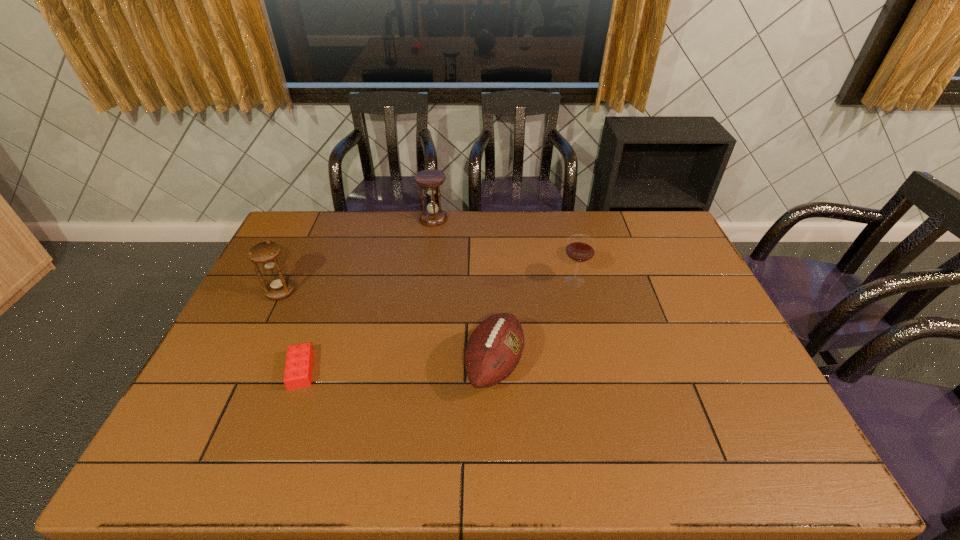
The width and height of the screenshot is (960, 540). I want to click on vacant space located 0.160m on the right of the wineglass, so click(x=637, y=281).

Locate an element on the screen. This screenshot has height=540, width=960. vacant space located on the back of the fourth object from left to right is located at coordinates (492, 289).

You are a GUI agent. You are given a task and a screenshot of the screen. Output one action in this format:
    pyautogui.click(x=<x>, y=<y>)
    Task: Click on the vacant region located 0.080m on the left of the Lego
    The height and width of the screenshot is (540, 960).
    Given the screenshot: What is the action you would take?
    pyautogui.click(x=255, y=370)

Image resolution: width=960 pixels, height=540 pixels. I want to click on object at the far edge, so click(x=433, y=216).

At what (x,y) coordinates should I click in order to perform the action: click on object at the left edge. Please return your answer as a coordinate pair (x, y). Looking at the image, I should click on (265, 253).

Identify the location of blank space at the far edge. (515, 227).

The image size is (960, 540). Find the location of `vacant area at the near edge of the desktop`. vacant area at the near edge of the desktop is located at coordinates (672, 471).

At what (x,y) coordinates should I click in order to perform the action: click on free region at the left edge of the desktop. Please return your answer as a coordinate pair (x, y). This screenshot has width=960, height=540. Looking at the image, I should click on (223, 346).

The height and width of the screenshot is (540, 960). I want to click on free space at the right edge of the desktop, so click(x=748, y=418).

In the image, there is a desktop. Where is `vacant space at the near left corner`? The image size is (960, 540). vacant space at the near left corner is located at coordinates (234, 444).